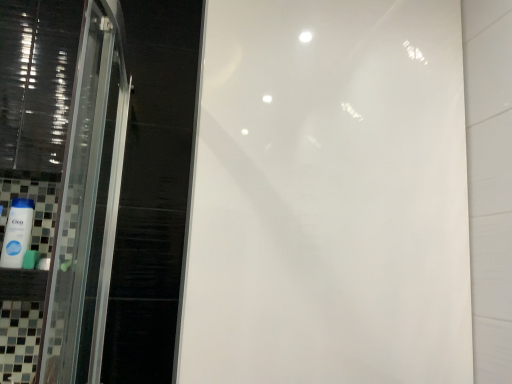
Question: Can you confirm if white glossy mouthwash at lower left is taller than green matte sponge at lower left?

Choices:
 (A) no
 (B) yes

Answer: (B)

Question: From a real-world perspective, is white glossy mouthwash at lower left on top of green matte sponge at lower left?

Choices:
 (A) yes
 (B) no

Answer: (A)

Question: Does white glossy mouthwash at lower left have a lesser height compared to green matte sponge at lower left?

Choices:
 (A) yes
 (B) no

Answer: (B)

Question: Considering the relative positions of white glossy mouthwash at lower left and green matte sponge at lower left in the image provided, is white glossy mouthwash at lower left behind green matte sponge at lower left?

Choices:
 (A) yes
 (B) no

Answer: (B)

Question: Is white glossy mouthwash at lower left not near green matte sponge at lower left?

Choices:
 (A) no
 (B) yes

Answer: (A)

Question: Considering the relative positions of white glossy mouthwash at lower left and green matte sponge at lower left in the image provided, is white glossy mouthwash at lower left in front of green matte sponge at lower left?

Choices:
 (A) yes
 (B) no

Answer: (A)

Question: Can we say green matte sponge at lower left lies outside white glossy mouthwash at lower left?

Choices:
 (A) yes
 (B) no

Answer: (A)

Question: From a real-world perspective, is green matte sponge at lower left below white glossy mouthwash at lower left?

Choices:
 (A) no
 (B) yes

Answer: (B)

Question: Is the depth of green matte sponge at lower left greater than that of white glossy mouthwash at lower left?

Choices:
 (A) no
 (B) yes

Answer: (B)

Question: Is green matte sponge at lower left at the left side of white glossy mouthwash at lower left?

Choices:
 (A) no
 (B) yes

Answer: (A)

Question: Considering the relative sizes of green matte sponge at lower left and white glossy mouthwash at lower left in the image provided, is green matte sponge at lower left taller than white glossy mouthwash at lower left?

Choices:
 (A) yes
 (B) no

Answer: (B)

Question: Does green matte sponge at lower left have a lesser width compared to white glossy mouthwash at lower left?

Choices:
 (A) yes
 (B) no

Answer: (A)

Question: Is white glossy mouthwash at lower left wider or thinner than green matte sponge at lower left?

Choices:
 (A) wide
 (B) thin

Answer: (A)